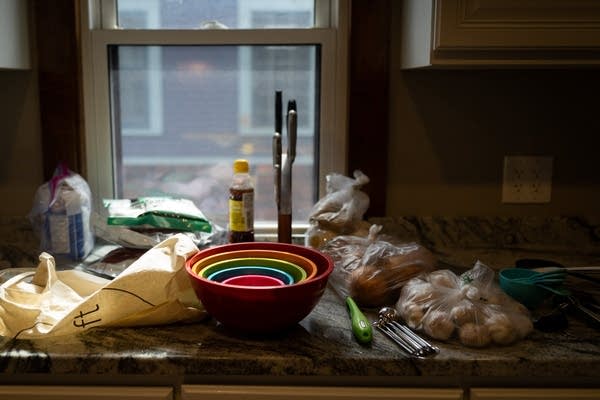
Locate an element on the screen. The width and height of the screenshot is (600, 400). brick walls is located at coordinates (198, 178), (184, 92).